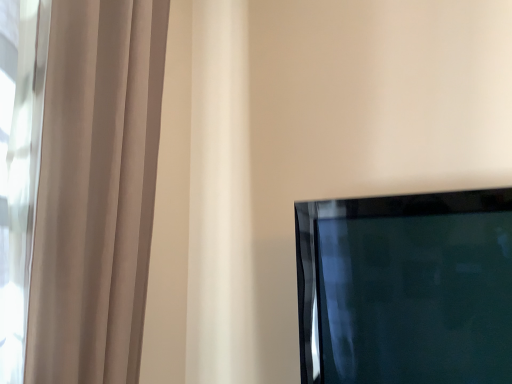
Consider the image. Measure the distance between point (352, 350) and camera.

The distance of point (352, 350) from camera is 1.10 meters.

Locate an element on the screen. matte black tv at lower right is located at coordinates (406, 289).

The width and height of the screenshot is (512, 384). Describe the element at coordinates (406, 289) in the screenshot. I see `matte black tv at lower right` at that location.

Where is `matte black tv at lower right`? Image resolution: width=512 pixels, height=384 pixels. matte black tv at lower right is located at coordinates (406, 289).